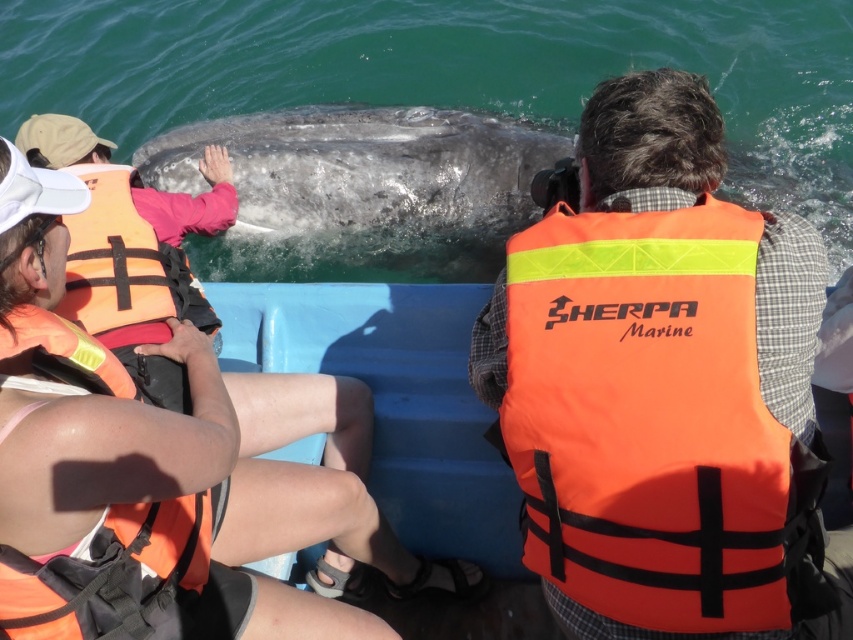
You are on a boat and see the gray textured whale at center and the orange life jacket at left. Which object is positioned to the right of the other?

The gray textured whale at center is positioned to the right of the orange life jacket at left.

You are on a boat observing a whale. There is an orange life vest at upper left and a gray textured whale at center. Which object is closer to you?

The orange life vest at upper left is closer to the viewer than the gray textured whale at center.

You are a photographer on the boat and want to capture a clear photo of the glossy water at whale center without the orange life vest at center blocking the view. Is there a way to adjust your position to achieve this?

The orange life vest at center is in front of the glossy water at whale center, so moving behind the orange life vest at center or to the side of it would allow you to capture the glossy water at whale center without obstruction.